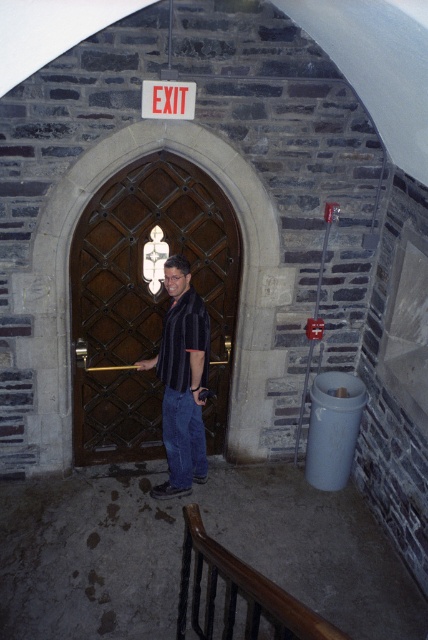
Question: Which point is closer to the camera?

Choices:
 (A) (101, 429)
 (B) (180, 308)

Answer: (B)

Question: Among these points, which one is farthest from the camera?

Choices:
 (A) pos(130,374)
 (B) pos(253,636)
 (C) pos(198,344)
 (D) pos(175,388)

Answer: (A)

Question: Can you confirm if dark wood door at center is positioned below striped cotton shirt at center?

Choices:
 (A) no
 (B) yes

Answer: (A)

Question: Is striped cotton shirt at center behind black striped shirt at center?

Choices:
 (A) no
 (B) yes

Answer: (A)

Question: Is concrete stairs at lower center positioned at the back of black striped shirt at center?

Choices:
 (A) yes
 (B) no

Answer: (B)

Question: Which object is positioned farthest from the striped cotton shirt at center?

Choices:
 (A) concrete stairs at lower center
 (B) black striped shirt at center
 (C) dark wood door at center

Answer: (A)